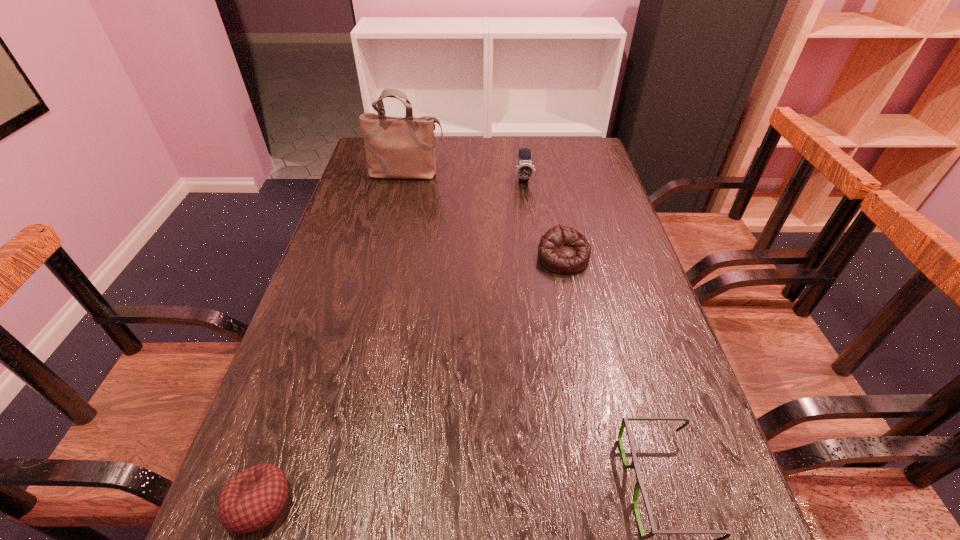
Find the location of a particular element. unoccupied position between the fourth shortest object and the tallest object is located at coordinates (466, 177).

Find the location of a particular element. vacant area that lies between the right beanbag and the watch is located at coordinates (543, 218).

I want to click on free space between the tallest object and the third farthest object, so click(x=485, y=216).

The width and height of the screenshot is (960, 540). I want to click on empty space between the shoulder bag and the left beanbag, so click(333, 339).

The image size is (960, 540). What are the coordinates of `blank region between the third nearest object and the shoulder bag` in the screenshot? It's located at (485, 216).

Image resolution: width=960 pixels, height=540 pixels. I want to click on object that is the third closest one to the tallest object, so click(254, 498).

Point out which object is positioned as the third nearest to the spectacles. Please provide its 2D coordinates. Your answer should be formatted as a tuple, i.e. [(x, y)], where the tuple contains the x and y coordinates of a point satisfying the conditions above.

[(525, 169)]